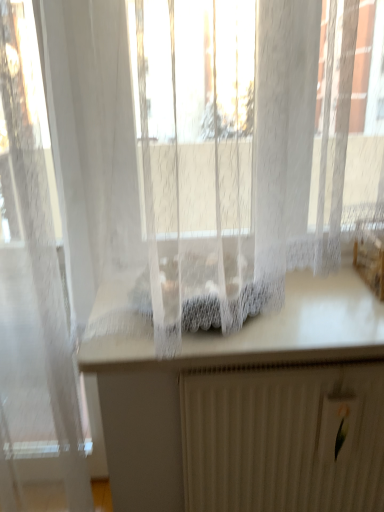
The height and width of the screenshot is (512, 384). Describe the element at coordinates (246, 329) in the screenshot. I see `white lace curtain at center` at that location.

The height and width of the screenshot is (512, 384). I want to click on white lace curtain at center, so click(x=246, y=329).

Locate an element on the screen. The image size is (384, 512). white matte radiator at lower center is located at coordinates (283, 438).

This screenshot has width=384, height=512. Describe the element at coordinates (283, 438) in the screenshot. I see `white matte radiator at lower center` at that location.

What is the approximate width of white matte radiator at lower center?

The width of white matte radiator at lower center is 9.46 centimeters.

The width and height of the screenshot is (384, 512). What are the coordinates of `white lace curtain at center` in the screenshot? It's located at (246, 329).

Would you say white lace curtain at center is to the left or to the right of white matte radiator at lower center in the picture?

white lace curtain at center is positioned on white matte radiator at lower center's left side.

Is the depth of white lace curtain at center greater than that of white matte radiator at lower center?

No.

Which is in front, point (334, 303) or point (239, 404)?

Point (239, 404)

From the image's perspective, which is below, white lace curtain at center or white matte radiator at lower center?

white matte radiator at lower center.

From a real-world perspective, which object stands above the other?

From a 3D spatial view, white lace curtain at center is above.

Which of these two, white lace curtain at center or white matte radiator at lower center, is thinner?

With smaller width is white matte radiator at lower center.

Consider the image. Considering the relative sizes of white lace curtain at center and white matte radiator at lower center in the image provided, is white lace curtain at center shorter than white matte radiator at lower center?

Indeed, white lace curtain at center has a lesser height compared to white matte radiator at lower center.

Can you confirm if white lace curtain at center is smaller than white matte radiator at lower center?

No, white lace curtain at center is not smaller than white matte radiator at lower center.

Would you say white lace curtain at center is outside white matte radiator at lower center?

Yes, white lace curtain at center is not within white matte radiator at lower center.

Is white lace curtain at center placed right next to white matte radiator at lower center?

white lace curtain at center is not next to white matte radiator at lower center, and they're not touching.

Does white lace curtain at center turn towards white matte radiator at lower center?

No, white lace curtain at center is not oriented towards white matte radiator at lower center.

How far apart are white lace curtain at center and white matte radiator at lower center?

A distance of 25.53 centimeters exists between white lace curtain at center and white matte radiator at lower center.

Where is `counter top on the left side of white matte radiator at lower center`? This screenshot has width=384, height=512. counter top on the left side of white matte radiator at lower center is located at coordinates (246, 329).

Is white matte radiator at lower center to the left of white lace curtain at center from the viewer's perspective?

Incorrect, white matte radiator at lower center is not on the left side of white lace curtain at center.

Which object is further away from the camera taking this photo, white matte radiator at lower center or white lace curtain at center?

white matte radiator at lower center is further from the camera.

Which is behind, point (206, 454) or point (238, 346)?

The point (206, 454) is behind.

From the image's perspective, is white matte radiator at lower center above or below white lace curtain at center?

white matte radiator at lower center is situated lower than white lace curtain at center in the image.

From a real-world perspective, is white matte radiator at lower center physically located above or below white lace curtain at center?

From a real-world perspective, white matte radiator at lower center is physically below white lace curtain at center.

From the picture: Considering the relative sizes of white matte radiator at lower center and white lace curtain at center in the image provided, is white matte radiator at lower center thinner than white lace curtain at center?

Yes.

Does white matte radiator at lower center have a lesser height compared to white lace curtain at center?

In fact, white matte radiator at lower center may be taller than white lace curtain at center.

Can you confirm if white matte radiator at lower center is smaller than white lace curtain at center?

Yes.

Is white lace curtain at center a part of white matte radiator at lower center?

No, white lace curtain at center is not inside white matte radiator at lower center.

From the picture: Is white matte radiator at lower center next to white lace curtain at center?

No, white matte radiator at lower center is not touching white lace curtain at center.

Could you tell me if white matte radiator at lower center is facing white lace curtain at center?

No, white matte radiator at lower center is not facing towards white lace curtain at center.

How different are the orientations of white matte radiator at lower center and white lace curtain at center in degrees?

white matte radiator at lower center and white lace curtain at center are facing 1.33 degrees away from each other.

At what (x,y) coordinates should I click in order to perform the action: click on radiator below the white lace curtain at center (from the image's perspective). Please return your answer as a coordinate pair (x, y). Image resolution: width=384 pixels, height=512 pixels. Looking at the image, I should click on (283, 438).

Where is `counter top that is on the left side of white matte radiator at lower center`? Image resolution: width=384 pixels, height=512 pixels. counter top that is on the left side of white matte radiator at lower center is located at coordinates (246, 329).

Find the location of `radiator that is behind the white lace curtain at center`. radiator that is behind the white lace curtain at center is located at coordinates (283, 438).